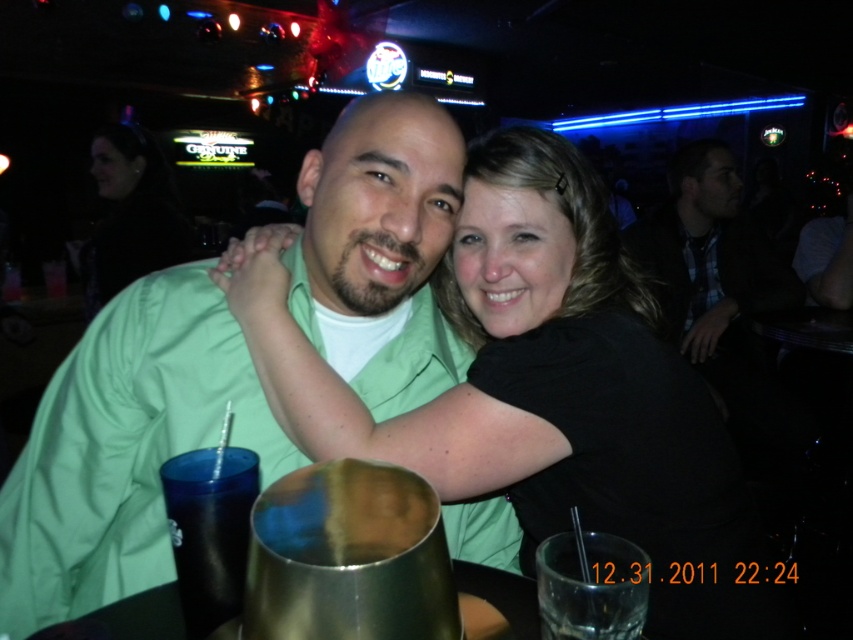
Question: Is green matte shirt at center to the right of black fabric at upper left from the viewer's perspective?

Choices:
 (A) no
 (B) yes

Answer: (B)

Question: Which of the following is the closest to the observer?

Choices:
 (A) (459, 346)
 (B) (695, 316)
 (C) (99, 259)
 (D) (450, 282)

Answer: (A)

Question: Does black matte shirt at center lie in front of green matte shirt at center?

Choices:
 (A) yes
 (B) no

Answer: (A)

Question: Which point is farther from the camera taking this photo?

Choices:
 (A) (714, 259)
 (B) (236, 394)
 (C) (503, 362)

Answer: (A)

Question: Which object appears closest to the camera in this image?

Choices:
 (A) green matte shirt at center
 (B) black fabric at upper left

Answer: (A)

Question: Does black matte shirt at center have a smaller size compared to dark brown leather jacket at upper right?

Choices:
 (A) yes
 (B) no

Answer: (B)